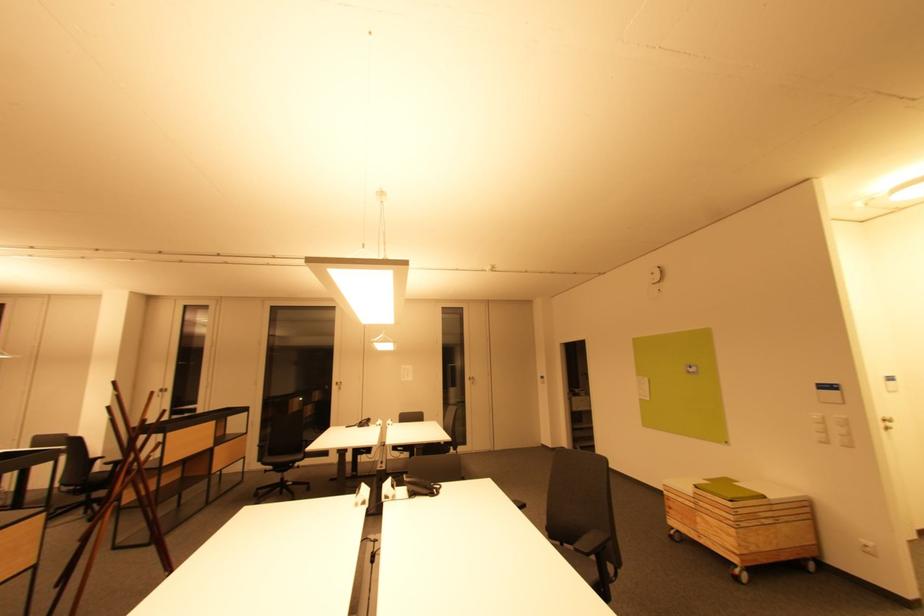
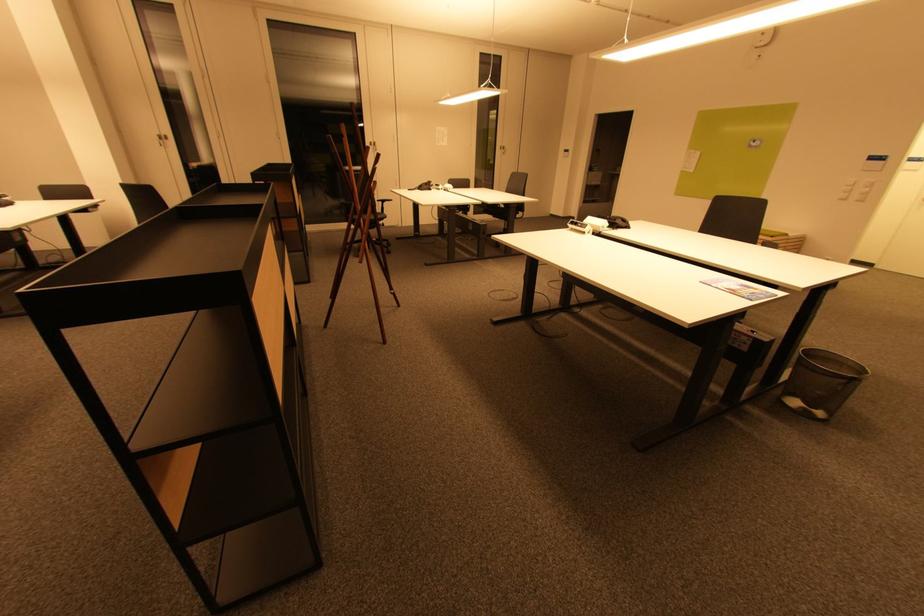
Find the pixel in the second image that matches point (167, 392) in the first image.

(166, 140)